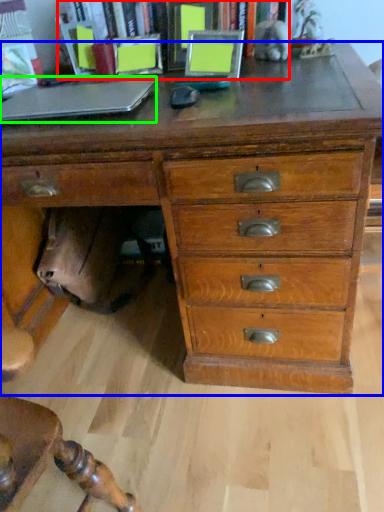
Question: Which object is positioned farthest from bookcase (highlighted by a red box)? Select from chest of drawers (highlighted by a blue box) and laptop (highlighted by a green box).

Choices:
 (A) chest of drawers
 (B) laptop

Answer: (A)